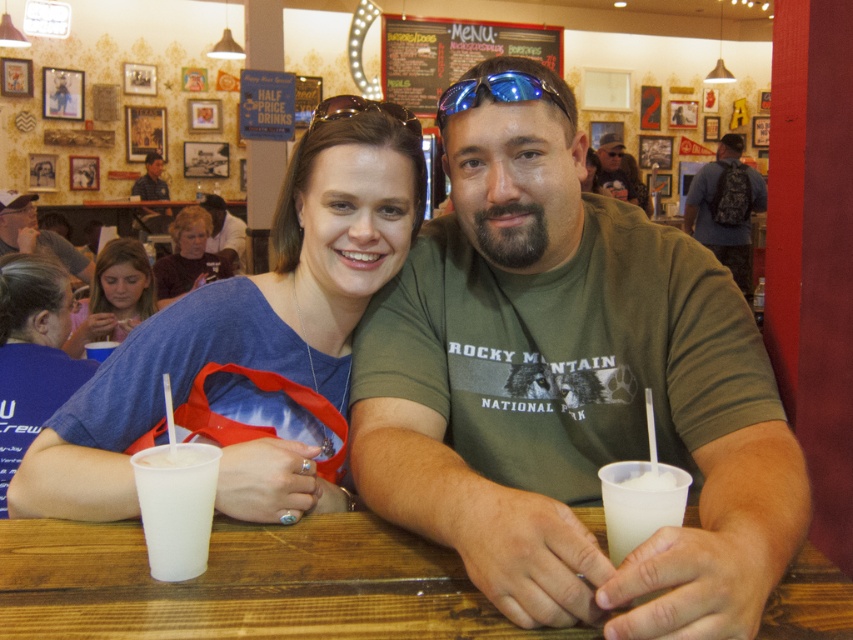
Question: From the image, what is the correct spatial relationship of blue fabric shirt at upper left in relation to matte black shirt at upper center?

Choices:
 (A) below
 (B) above

Answer: (A)

Question: Is matte brown sweater at upper left smaller than white frosted cup at center?

Choices:
 (A) no
 (B) yes

Answer: (A)

Question: Which object is the farthest from the sunglasses at center?

Choices:
 (A) chalkboard menu at upper center
 (B) matte plastic cup at lower left

Answer: (A)

Question: Among these points, which one is farthest from the camera?

Choices:
 (A) (547, 88)
 (B) (146, 179)

Answer: (B)

Question: Is brown wooden table at center to the left of matte plastic cup at lower left from the viewer's perspective?

Choices:
 (A) yes
 (B) no

Answer: (B)

Question: Which object is closer to the camera taking this photo?

Choices:
 (A) white frosted cup at center
 (B) blue uniform shirt at upper left
 (C) matte black shirt at upper center
 (D) blue fabric shirt at upper left

Answer: (D)